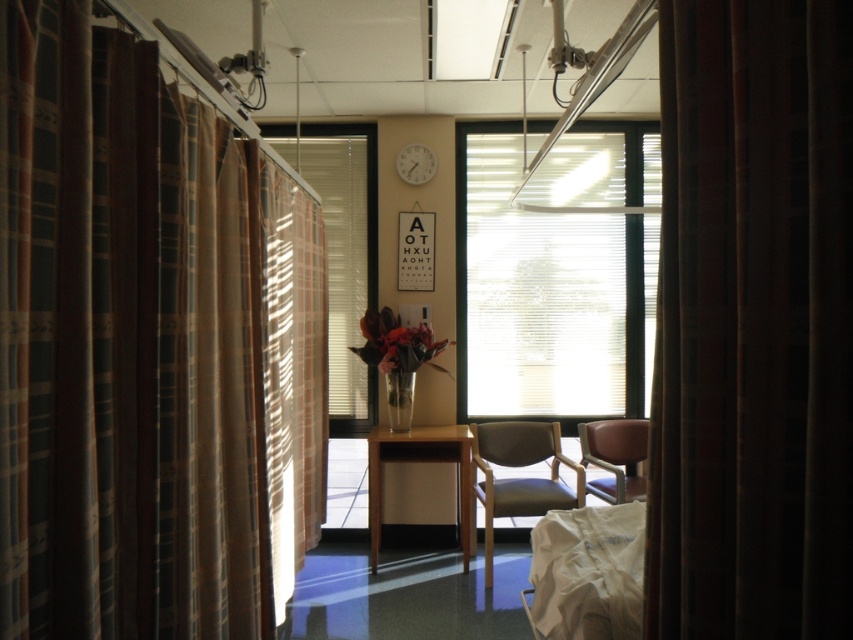
Is point (28, 49) closer to camera compared to point (477, 385)?

Yes, point (28, 49) is in front of point (477, 385).

Is point (227, 369) farther from viewer compared to point (593, 332)?

No, (227, 369) is closer to viewer.

Who is more distant from viewer, [213,412] or [606,198]?

Point [606,198]

This screenshot has height=640, width=853. Find the location of `plaid fabric curtain at left`. plaid fabric curtain at left is located at coordinates (148, 346).

Between translucent fabric window at center and white plastic clock at upper center, which one is positioned higher?

Positioned higher is white plastic clock at upper center.

Based on the photo, which is below, translucent fabric window at center or white plastic clock at upper center?

Positioned lower is translucent fabric window at center.

Is point (286, 124) in front of point (418, 184)?

No, it is behind (418, 184).

Locate an element on the screen. The height and width of the screenshot is (640, 853). translucent fabric window at center is located at coordinates (346, 259).

Measure the distance between point (822, 160) and camera.

Point (822, 160) is 36.42 inches from camera.

Between plaid fabric curtain at right and white plastic clock at upper center, which one has less height?

Standing shorter between the two is white plastic clock at upper center.

The image size is (853, 640). In order to click on plaid fabric curtain at right in this screenshot , I will do `click(753, 323)`.